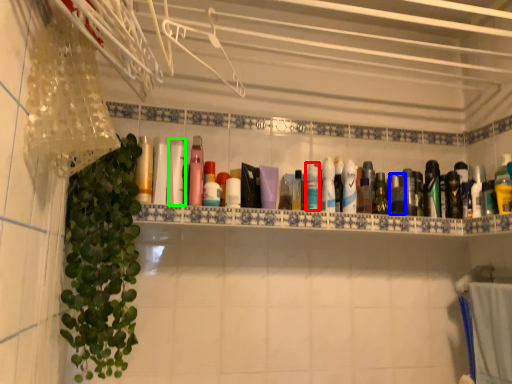
Question: Which object is positioned farthest from mouthwash (highlighted by a red box)? Select from mouthwash (highlighted by a blue box) and mouthwash (highlighted by a green box).

Choices:
 (A) mouthwash
 (B) mouthwash

Answer: (B)